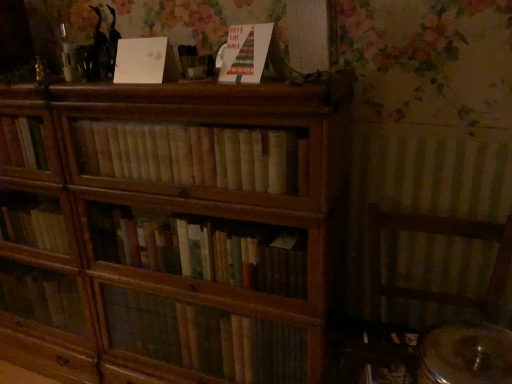
Question: In which direction should I rotate to look at matte paper card at upper center, the first paperback book from the right?

Choices:
 (A) left
 (B) right

Answer: (A)

Question: Is white matte paper at upper center, the 2th paperback book when ordered from right to left, oriented towards matte paper card at upper center, which is the 2th paperback book in left-to-right order?

Choices:
 (A) no
 (B) yes

Answer: (A)

Question: From the image's perspective, does white matte paper at upper center, the 2th paperback book when ordered from right to left, appear higher than matte paper card at upper center, the first paperback book from the right?

Choices:
 (A) no
 (B) yes

Answer: (B)

Question: Does white matte paper at upper center, the 2th paperback book when ordered from right to left, have a greater width compared to matte paper card at upper center, the first paperback book from the right?

Choices:
 (A) yes
 (B) no

Answer: (B)

Question: Could matte paper card at upper center, the first paperback book from the right, be considered to be inside white matte paper at upper center, the 2th paperback book when ordered from right to left?

Choices:
 (A) no
 (B) yes

Answer: (A)

Question: Is white matte paper at upper center, the first paperback book when ordered from left to right, bigger than matte paper card at upper center, the first paperback book from the right?

Choices:
 (A) yes
 (B) no

Answer: (B)

Question: Does white matte paper at upper center, the 2th paperback book when ordered from right to left, appear on the right side of matte paper card at upper center, the first paperback book from the right?

Choices:
 (A) no
 (B) yes

Answer: (A)

Question: Can you confirm if matte paper card at upper center, the first paperback book from the right, is smaller than white matte paper at upper center, the first paperback book when ordered from left to right?

Choices:
 (A) no
 (B) yes

Answer: (A)

Question: Is matte paper card at upper center, which is the 2th paperback book in left-to-right order, in contact with white matte paper at upper center, the first paperback book when ordered from left to right?

Choices:
 (A) yes
 (B) no

Answer: (B)

Question: Does matte paper card at upper center, which is the 2th paperback book in left-to-right order, have a greater width compared to white matte paper at upper center, the 2th paperback book when ordered from right to left?

Choices:
 (A) yes
 (B) no

Answer: (A)

Question: Is matte paper card at upper center, which is the 2th paperback book in left-to-right order, to the left of white matte paper at upper center, the 2th paperback book when ordered from right to left, from the viewer's perspective?

Choices:
 (A) no
 (B) yes

Answer: (A)

Question: Does matte paper card at upper center, which is the 2th paperback book in left-to-right order, have a larger size compared to white matte paper at upper center, the first paperback book when ordered from left to right?

Choices:
 (A) no
 (B) yes

Answer: (B)

Question: Is matte paper card at upper center, the first paperback book from the right, thinner than white matte paper at upper center, the first paperback book when ordered from left to right?

Choices:
 (A) yes
 (B) no

Answer: (B)

Question: Does light brown wooden books at center lie behind white matte paper at upper center, the 2th paperback book when ordered from right to left?

Choices:
 (A) yes
 (B) no

Answer: (B)